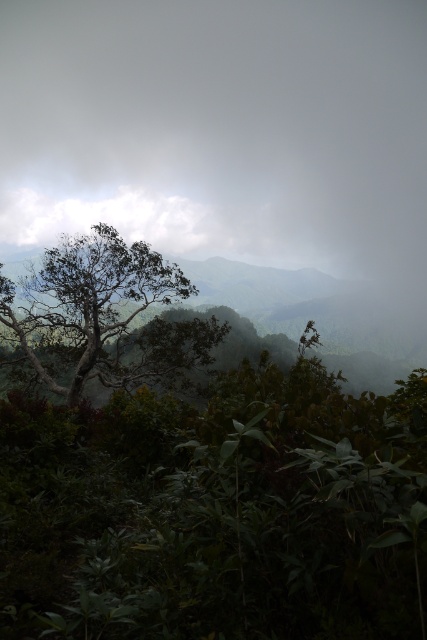
Which is behind, point (116, 282) or point (178, 232)?

The point (178, 232) is more distant.

Image resolution: width=427 pixels, height=640 pixels. I want to click on green matte tree at center, so click(102, 316).